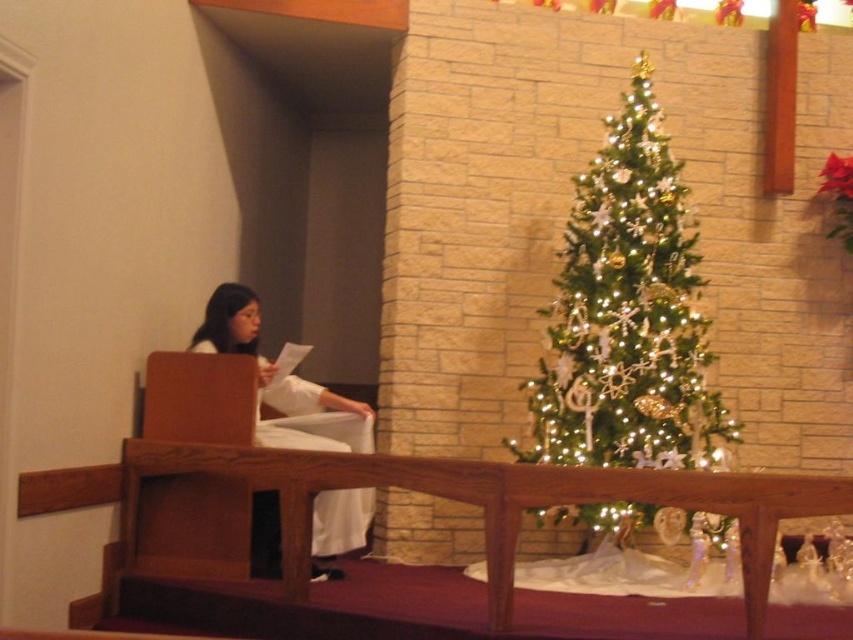
Who is taller, iridescent green tree at center or white cloth at left?

Standing taller between the two is iridescent green tree at center.

Is point (622, 339) less distant than point (318, 573)?

No, (622, 339) is further to viewer.

The height and width of the screenshot is (640, 853). Find the location of `iridescent green tree at center`. iridescent green tree at center is located at coordinates (628, 314).